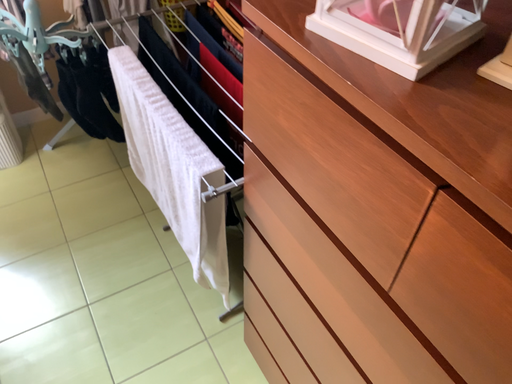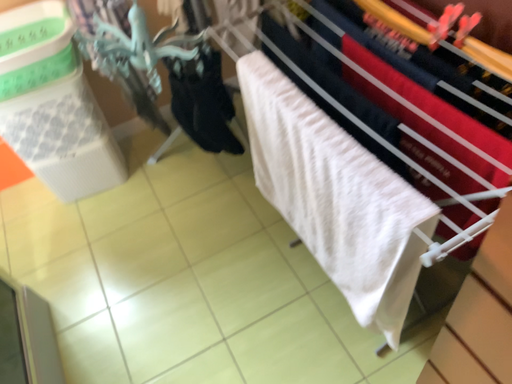
Question: Which way did the camera rotate in the video?

Choices:
 (A) rotated left
 (B) rotated right

Answer: (A)